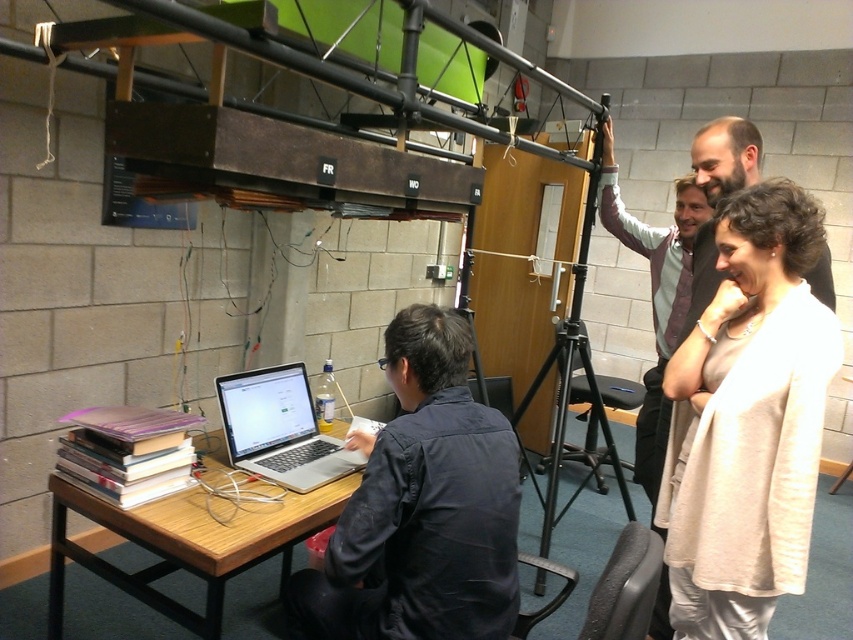
What do you see at coordinates (747, 420) in the screenshot? I see `light beige sweater at right` at bounding box center [747, 420].

Is point (799, 417) positioned behind point (546, 532)?

No, it is in front of (546, 532).

The height and width of the screenshot is (640, 853). Describe the element at coordinates (747, 420) in the screenshot. I see `light beige sweater at right` at that location.

Where is `light beige sweater at right`? This screenshot has width=853, height=640. light beige sweater at right is located at coordinates (747, 420).

Based on the photo, between light beige sweater at right and dark blue shirt at center, which one has more height?

Standing taller between the two is light beige sweater at right.

Does point (712, 588) lie behind point (350, 433)?

No, (712, 588) is closer to viewer.

Locate an element on the screen. light beige sweater at right is located at coordinates [747, 420].

Is point (421, 369) more distant than point (184, 497)?

No, it is not.

Does dark blue shirt at center have a larger size compared to wooden table at lower left?

Incorrect, dark blue shirt at center is not larger than wooden table at lower left.

Identify the location of dark blue shirt at center. (422, 506).